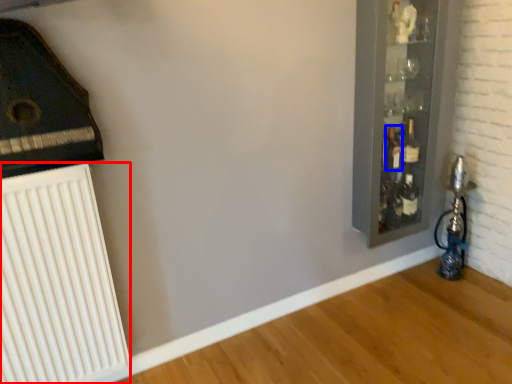
Question: Which of the following is the farthest to the observer, radiator (highlighted by a red box) or bottle (highlighted by a blue box)?

Choices:
 (A) radiator
 (B) bottle

Answer: (B)